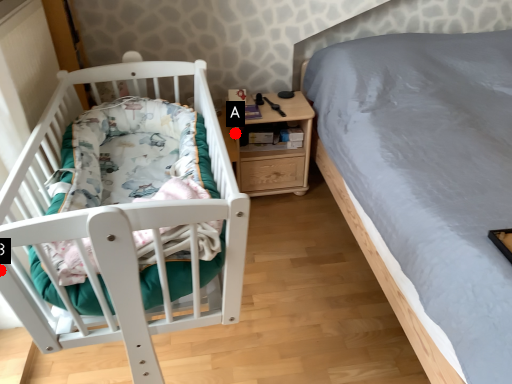
Question: Two points are circled on the image, labeled by A and B beside each circle. Among these points, which one is nearest to the camera?

Choices:
 (A) A is closer
 (B) B is closer

Answer: (B)